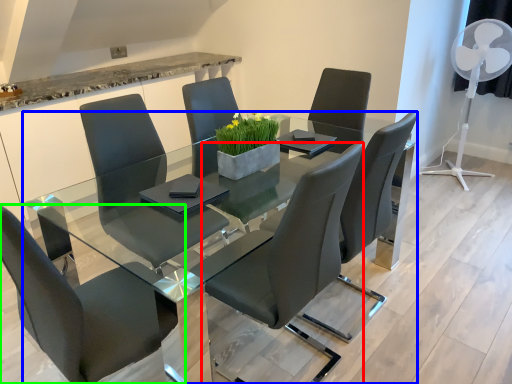
Question: Based on their relative distances, which object is nearer to chair (highlighted by a red box)? Choose from table (highlighted by a blue box) and chair (highlighted by a green box).

Choices:
 (A) table
 (B) chair

Answer: (A)